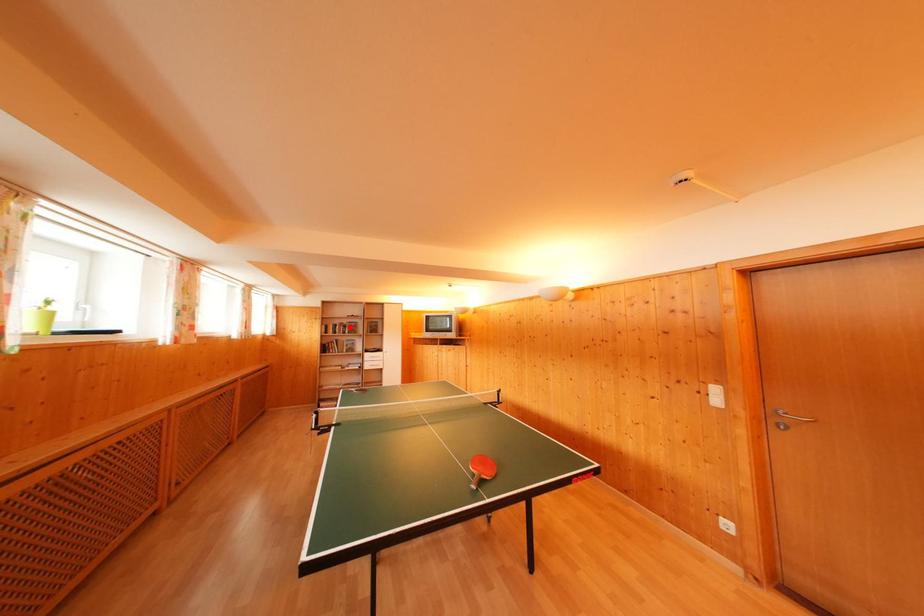
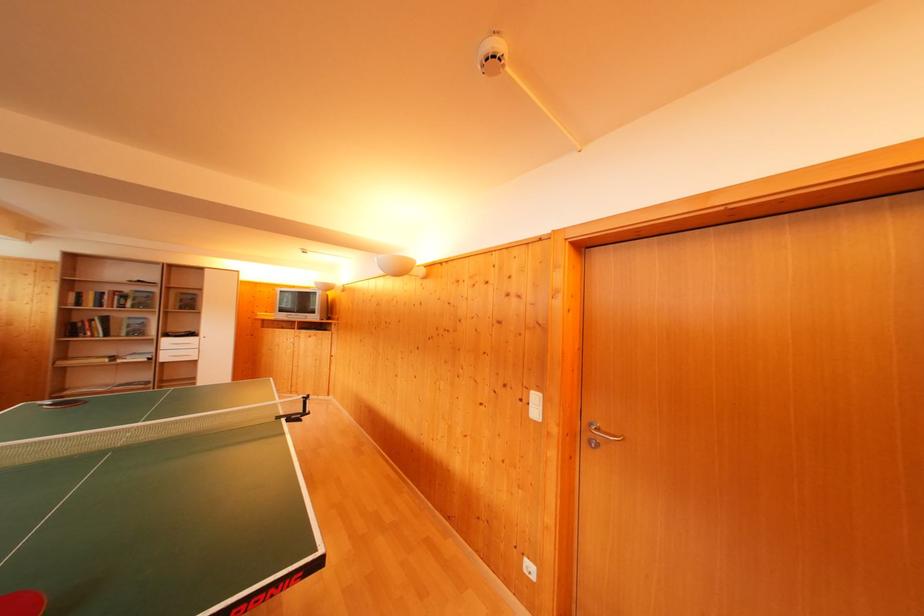
Locate, in the second image, the point that corresponds to the highlighted location in the first image.

(131, 294)